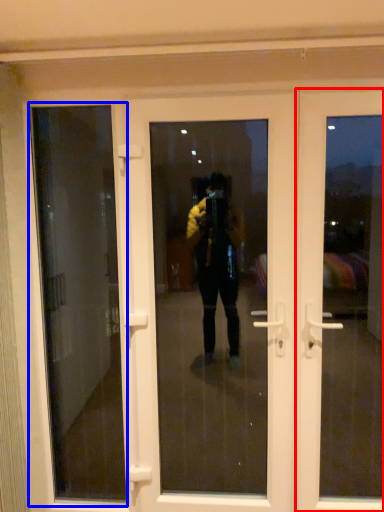
Question: Which object is further to the camera taking this photo, door (highlighted by a red box) or window screen (highlighted by a blue box)?

Choices:
 (A) door
 (B) window screen

Answer: (B)